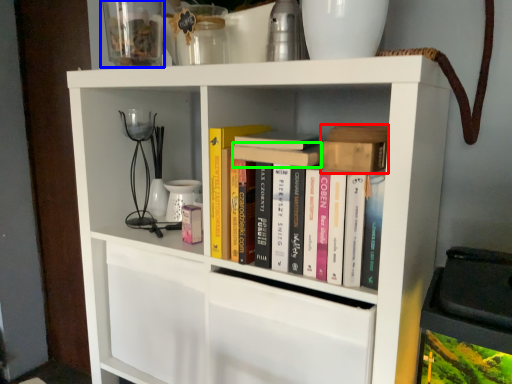
Question: Which is nearer to the book (highlighted by a red box)? glass vase (highlighted by a blue box) or book (highlighted by a green box).

Choices:
 (A) glass vase
 (B) book

Answer: (B)